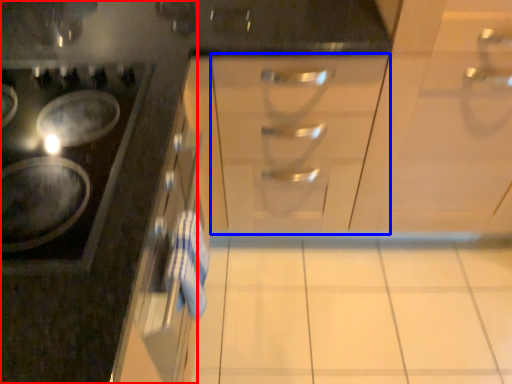
Question: Which object appears farthest to the camera in this image, cabinetry (highlighted by a red box) or drawer (highlighted by a blue box)?

Choices:
 (A) cabinetry
 (B) drawer

Answer: (B)